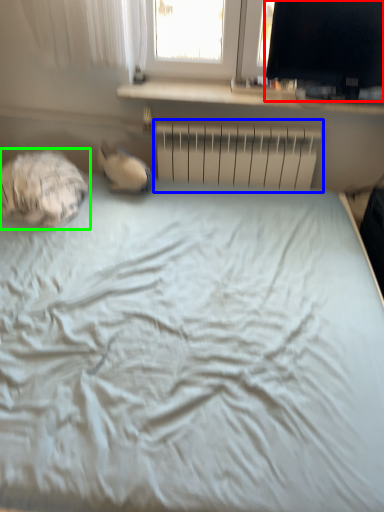
Question: Which object is the closest to the computer monitor (highlighted by a red box)? Choose among these: radiator (highlighted by a blue box) or sleeping bag (highlighted by a green box).

Choices:
 (A) radiator
 (B) sleeping bag

Answer: (A)